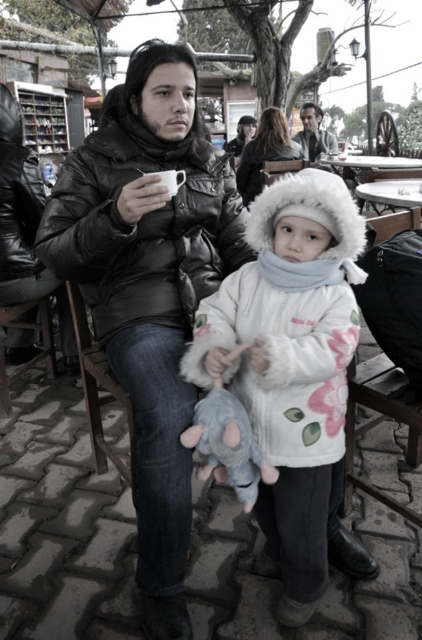
From the picture: You are a delivery person trying to place a package on the white glossy picnic table at upper center. The package is 4 feet in length. Can you safely place the package on the table without it hanging off the edge? Please consider the distance between the white fur coat at center and the table.

The white fur coat at center is 3.55 feet away from the white glossy picnic table at upper center. Since the package is 4 feet long, which is longer than the distance between the coat and the table, placing it there would cause the package to extend beyond the table and hang off the edge. Therefore, it is not safe to place the package there.

You are a photographer trying to capture the scene with a camera that has a limited field of view. You want to ensure both the white fluffy coat at center and the wooden at left are fully visible in the frame. Based on their positions, which object should you focus on to include both in the shot?

The white fluffy coat at center is located above the wooden at left, so focusing on the white fluffy coat at center would allow the photographer to capture both objects in the frame since it is positioned higher up.